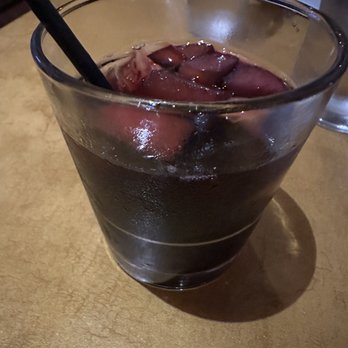
Find the location of a particular element. The image size is (348, 348). water glass is located at coordinates (336, 119).